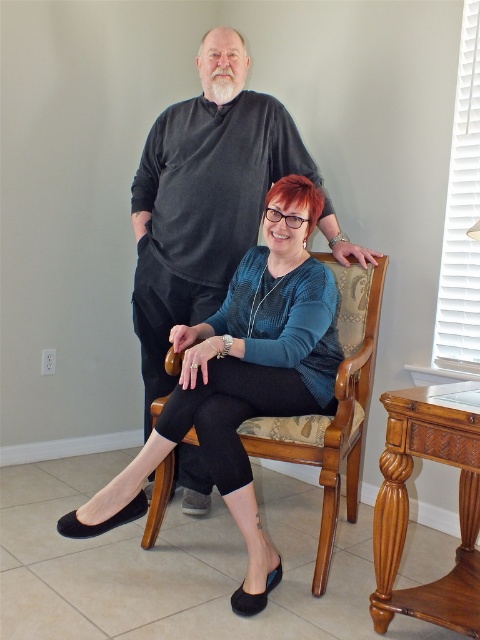
You are standing in the room and want to move from the point marked as point (175, 118) to the point marked as point (324, 467). Can you walk directly between them without needing to go around any obstacles?

Point (175, 118) is behind point (324, 467), so you cannot walk directly between them without going around the obstacle in front of point (324, 467).

You are a photographer setting up a shoot in this room. You need to decide whether the dark gray sweater at center can be seen from the back of the wooden armchair at center. Based on their positions, can you confirm if the sweater is visible from behind the chair?

The dark gray sweater at center is above the wooden armchair at center, so it would be visible from behind the chair since it is positioned higher up.